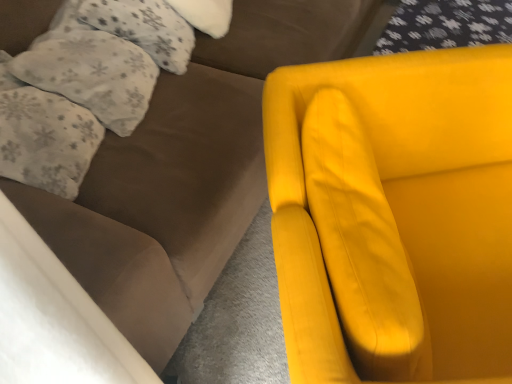
Question: Is fluffy white pillow at upper left, the third pillow from the top, located within matte yellow armchair at right?

Choices:
 (A) yes
 (B) no

Answer: (B)

Question: Considering the relative positions of matte yellow armchair at right and fluffy white pillow at upper left, the third pillow from the top, in the image provided, is matte yellow armchair at right to the right of fluffy white pillow at upper left, the third pillow from the top, from the viewer's perspective?

Choices:
 (A) yes
 (B) no

Answer: (A)

Question: Could you tell me if matte yellow armchair at right is turned towards fluffy white pillow at upper left, the third pillow from the top?

Choices:
 (A) no
 (B) yes

Answer: (A)

Question: Can you confirm if matte yellow armchair at right is taller than fluffy white pillow at upper left, which ranks as the 1th pillow in bottom-to-top order?

Choices:
 (A) no
 (B) yes

Answer: (B)

Question: Is matte yellow armchair at right bigger than fluffy white pillow at upper left, the third pillow from the top?

Choices:
 (A) no
 (B) yes

Answer: (B)

Question: From their relative heights in the image, would you say fluffy white pillow at upper left, acting as the third pillow starting from the bottom, is taller or shorter than white fluffy pillow at upper left, the second pillow positioned from the top?

Choices:
 (A) tall
 (B) short

Answer: (B)

Question: Is fluffy white pillow at upper left, acting as the third pillow starting from the bottom, in front of or behind white fluffy pillow at upper left, the second pillow positioned from the top, in the image?

Choices:
 (A) front
 (B) behind

Answer: (B)

Question: From a real-world perspective, is fluffy white pillow at upper left, acting as the third pillow starting from the bottom, physically located above or below white fluffy pillow at upper left, the second pillow positioned from the top?

Choices:
 (A) above
 (B) below

Answer: (B)

Question: In the image, is fluffy white pillow at upper left, acting as the third pillow starting from the bottom, on the left side or the right side of white fluffy pillow at upper left, the second pillow positioned from the top?

Choices:
 (A) left
 (B) right

Answer: (B)

Question: Is matte yellow armchair at right inside the boundaries of white fluffy pillow at upper left, the second pillow positioned from the top, or outside?

Choices:
 (A) inside
 (B) outside

Answer: (B)

Question: Does point (305, 96) appear closer or farther from the camera than point (99, 109)?

Choices:
 (A) farther
 (B) closer

Answer: (B)

Question: Is matte yellow armchair at right wider or thinner than white fluffy pillow at upper left, the second pillow positioned from the top?

Choices:
 (A) wide
 (B) thin

Answer: (A)

Question: From a real-world perspective, relative to white fluffy pillow at upper left, the second pillow when ordered from bottom to top, is matte yellow armchair at right vertically above or below?

Choices:
 (A) below
 (B) above

Answer: (A)

Question: Based on their positions, is matte yellow armchair at right located to the left or right of fluffy white pillow at upper left, which ranks as the 1th pillow in bottom-to-top order?

Choices:
 (A) left
 (B) right

Answer: (B)

Question: Do you think matte yellow armchair at right is within fluffy white pillow at upper left, the third pillow from the top, or outside of it?

Choices:
 (A) outside
 (B) inside

Answer: (A)